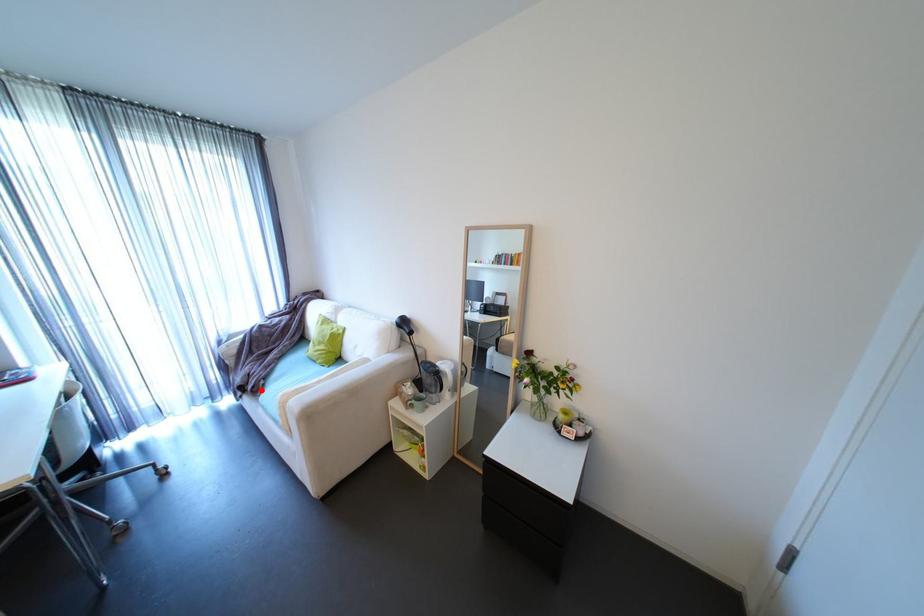
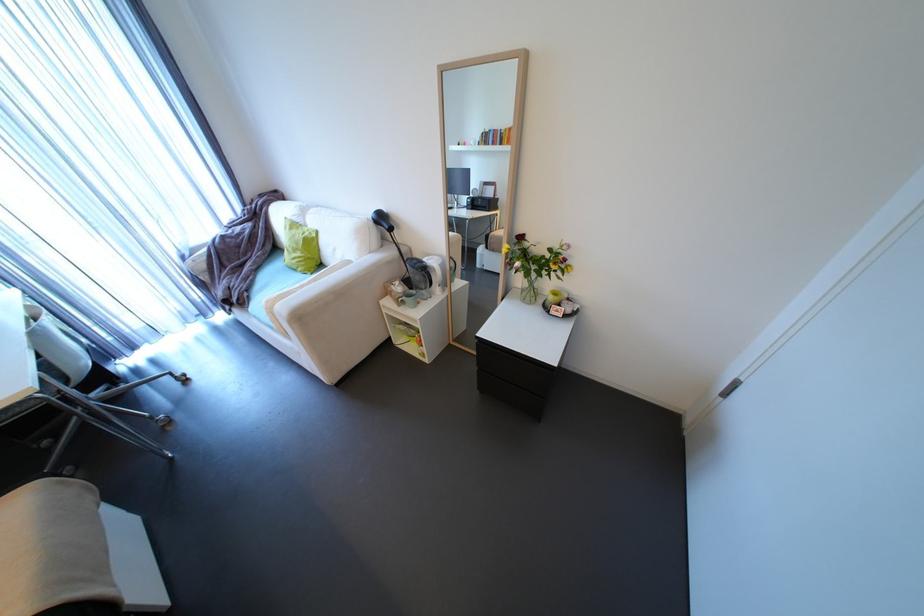
Question: I am providing you with two images of the same scene from different viewpoints. A red point is shown in image1. For the corresponding object point in image2, is it positioned nearer or farther from the camera?

Choices:
 (A) Nearer
 (B) Farther

Answer: (B)